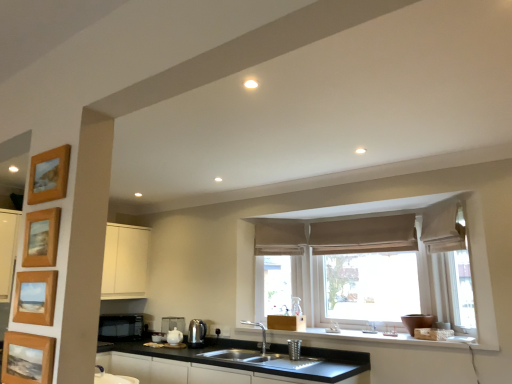
The width and height of the screenshot is (512, 384). What do you see at coordinates (279, 238) in the screenshot?
I see `brown fabric curtain at center, which is counted as the first curtain, starting from the left` at bounding box center [279, 238].

Where is `brown fabric curtain at center, the 3th curtain viewed from the right`? Image resolution: width=512 pixels, height=384 pixels. brown fabric curtain at center, the 3th curtain viewed from the right is located at coordinates (279, 238).

You are a GUI agent. You are given a task and a screenshot of the screen. Output one action in this format:
    pyautogui.click(x=<x>, y=<y>)
    Task: Click on the metallic silver cup at sink, the fourth appliance viewed from the back
    The image size is (512, 384).
    Given the screenshot: What is the action you would take?
    pyautogui.click(x=294, y=349)

What do you see at coordinates (365, 337) in the screenshot? I see `white matte window sill at center` at bounding box center [365, 337].

Locate an element on the screen. wooden photo frame at left, which appears as the fourth picture frame when viewed from the top is located at coordinates (27, 358).

Locate an element on the screen. beige fabric curtain at center, the second curtain positioned from the right is located at coordinates (364, 235).

Locate an element on the screen. brown fabric curtain at center, which is counted as the first curtain, starting from the left is located at coordinates point(279,238).

Is wooden picture frame at upper left, marked as the 2th picture frame in a top-to-bottom arrangement, facing towards beige fabric curtain at upper right, the first curtain viewed from the right?

No, wooden picture frame at upper left, marked as the 2th picture frame in a top-to-bottom arrangement, is not aimed at beige fabric curtain at upper right, the first curtain viewed from the right.

From the image's perspective, would you say wooden picture frame at upper left, marked as the 2th picture frame in a top-to-bottom arrangement, is positioned over beige fabric curtain at upper right, marked as the 3th curtain in a left-to-right arrangement?

Correct, wooden picture frame at upper left, marked as the 2th picture frame in a top-to-bottom arrangement, appears higher than beige fabric curtain at upper right, marked as the 3th curtain in a left-to-right arrangement, in the image.

Between wooden picture frame at upper left, marked as the 2th picture frame in a top-to-bottom arrangement, and beige fabric curtain at upper right, marked as the 3th curtain in a left-to-right arrangement, which one has more height?

Standing taller between the two is beige fabric curtain at upper right, marked as the 3th curtain in a left-to-right arrangement.

Which object is positioned more to the left, wooden picture frame at upper left, the third picture frame from the bottom, or beige fabric curtain at upper right, the first curtain viewed from the right?

wooden picture frame at upper left, the third picture frame from the bottom.

Is wooden picture frame at upper left, the third picture frame from the bottom, positioned in front of beige fabric window at center?

Yes, the depth of wooden picture frame at upper left, the third picture frame from the bottom, is less than that of beige fabric window at center.

From a real-world perspective, is wooden picture frame at upper left, the third picture frame from the bottom, positioned over beige fabric window at center based on gravity?

Yes, from a real-world perspective, wooden picture frame at upper left, the third picture frame from the bottom, is above beige fabric window at center.

Which point is more forward, (33, 255) or (324, 299)?

Point (33, 255)

Looking at this image, considering the relative sizes of wooden picture frame at upper left, which appears as the 1th picture frame when viewed from the top, and black matte microwave at lower left, marked as the first appliance in a left-to-right arrangement, in the image provided, is wooden picture frame at upper left, which appears as the 1th picture frame when viewed from the top, shorter than black matte microwave at lower left, marked as the first appliance in a left-to-right arrangement,?

Indeed, wooden picture frame at upper left, which appears as the 1th picture frame when viewed from the top, has a lesser height compared to black matte microwave at lower left, marked as the first appliance in a left-to-right arrangement.

Who is smaller, wooden picture frame at upper left, which appears as the 1th picture frame when viewed from the top, or black matte microwave at lower left, the 1th appliance positioned from the back?

wooden picture frame at upper left, which appears as the 1th picture frame when viewed from the top.

Can you confirm if wooden picture frame at upper left, which appears as the 1th picture frame when viewed from the top, is positioned to the right of black matte microwave at lower left, which is counted as the fourth appliance, starting from the right?

Correct, you'll find wooden picture frame at upper left, which appears as the 1th picture frame when viewed from the top, to the right of black matte microwave at lower left, which is counted as the fourth appliance, starting from the right.

From the image's perspective, is wooden picture frame at upper left, which is the 4th picture frame from bottom to top, on black matte microwave at lower left, marked as the first appliance in a left-to-right arrangement?

Yes, from the image's perspective, wooden picture frame at upper left, which is the 4th picture frame from bottom to top, is on top of black matte microwave at lower left, marked as the first appliance in a left-to-right arrangement.

Which object is wider, beige fabric curtain at right or beige fabric curtain at center, the second curtain positioned from the right?

beige fabric curtain at right.

From the image's perspective, which is below, beige fabric curtain at right or beige fabric curtain at center, the second curtain positioned from the right?

beige fabric curtain at right.

Looking at this image, can you confirm if beige fabric curtain at right is smaller than beige fabric curtain at center, which is the 2th curtain in left-to-right order?

No.

From a real-world perspective, which object rests below the other?

beige fabric curtain at right is physically lower.

Which is more to the left, brown fabric curtain at center, the 3th curtain viewed from the right, or white matte window sill at center?

brown fabric curtain at center, the 3th curtain viewed from the right.

This screenshot has height=384, width=512. Identify the location of window sill lying on the right of brown fabric curtain at center, which is counted as the first curtain, starting from the left. (365, 337).

From a real-world perspective, is brown fabric curtain at center, the 3th curtain viewed from the right, above or below white matte window sill at center?

brown fabric curtain at center, the 3th curtain viewed from the right, is situated higher than white matte window sill at center in the real world.

Considering the points (257, 221) and (329, 335), which point is behind, point (257, 221) or point (329, 335)?

Positioned behind is point (257, 221).

Between point (188, 344) and point (359, 330), which one is positioned in front?

The point (359, 330) is closer.

Between satin silver kettle at lower center, the 2th appliance viewed from the front, and white matte window sill at center, which one appears on the left side from the viewer's perspective?

satin silver kettle at lower center, the 2th appliance viewed from the front.

From the image's perspective, does satin silver kettle at lower center, the 2th appliance viewed from the front, appear higher than white matte window sill at center?

Actually, satin silver kettle at lower center, the 2th appliance viewed from the front, appears below white matte window sill at center in the image.

I want to click on the 2nd picture frame to the right when counting from the wooden framed picture at left, the 3th picture frame in the top-to-bottom sequence, so point(49,175).

Between wooden picture frame at upper left, which appears as the 1th picture frame when viewed from the top, and wooden framed picture at left, the 2th picture frame positioned from the bottom, which one appears on the right side from the viewer's perspective?

From the viewer's perspective, wooden picture frame at upper left, which appears as the 1th picture frame when viewed from the top, appears more on the right side.

Can you confirm if wooden picture frame at upper left, which is the 4th picture frame from bottom to top, is shorter than wooden framed picture at left, the 3th picture frame in the top-to-bottom sequence?

No.

From a real-world perspective, which curtain is the 1st one above the wooden picture frame at upper left, marked as the 2th picture frame in a top-to-bottom arrangement? Please provide its 2D coordinates.

[(443, 228)]

Find the location of a particular element. The width and height of the screenshot is (512, 384). the 4th picture frame to the left when counting from the beige fabric window at center is located at coordinates (41, 238).

Looking at the image, which one is located further to brown fabric curtain at center, which is counted as the first curtain, starting from the left, white matte window sill at center or beige fabric window at center?

white matte window sill at center.

When comparing their distances from beige fabric curtain at upper right, the first curtain viewed from the right, does white ceramic teapot at lower center, the 2th appliance positioned from the left, or beige fabric window at center seem further?

Based on the image, white ceramic teapot at lower center, the 2th appliance positioned from the left, appears to be further to beige fabric curtain at upper right, the first curtain viewed from the right.

From the image, which object appears to be farther from white matte window sill at center, satin silver kettle at lower center, which ranks as the 3th appliance in back-to-front order, or beige fabric curtain at center, the second curtain positioned from the right?

satin silver kettle at lower center, which ranks as the 3th appliance in back-to-front order.

From the image, which object appears to be farther from black matte cabinet at lower center, beige fabric curtain at center, which is the 2th curtain in left-to-right order, or beige fabric curtain at upper right, marked as the 3th curtain in a left-to-right arrangement?

beige fabric curtain at upper right, marked as the 3th curtain in a left-to-right arrangement, lies further to black matte cabinet at lower center than the other object.

Based on their spatial positions, is beige fabric curtain at center, the second curtain positioned from the right, or white ceramic teapot at lower center, the 2th appliance positioned from the left, closer to black matte microwave at lower left, the 1th appliance positioned from the back?

Among the two, white ceramic teapot at lower center, the 2th appliance positioned from the left, is located nearer to black matte microwave at lower left, the 1th appliance positioned from the back.

Considering their positions, is wooden photo frame at left, which appears as the fourth picture frame when viewed from the top, positioned further to white ceramic teapot at lower center, the 2th appliance positioned from the left, than black matte cabinet at lower center?

wooden photo frame at left, which appears as the fourth picture frame when viewed from the top, is positioned further to the anchor white ceramic teapot at lower center, the 2th appliance positioned from the left.

From the image, which object appears to be farther from black matte microwave at lower left, arranged as the 4th appliance when viewed from the front, brown fabric curtain at center, which is counted as the first curtain, starting from the left, or white matte window sill at center?

white matte window sill at center is further to black matte microwave at lower left, arranged as the 4th appliance when viewed from the front.

From the image, which object appears to be nearer to white matte window sill at center, beige fabric window at center or wooden picture frame at upper left, the third picture frame from the bottom?

Based on the image, beige fabric window at center appears to be nearer to white matte window sill at center.

Locate an element on the screen. window sill between black matte microwave at lower left, the 1th appliance positioned from the back, and beige fabric window at center, in the horizontal direction is located at coordinates (365, 337).

What are the coordinates of `curtain between white ceramic teapot at lower center, positioned as the 2th appliance in back-to-front order, and metallic silver cup at sink, which appears as the first appliance when viewed from the front, from left to right` in the screenshot? It's located at (279, 238).

Find the location of a particular element. picture frame positioned between wooden picture frame at upper left, the third picture frame from the bottom, and beige fabric window at center from near to far is located at coordinates (49, 175).

This screenshot has height=384, width=512. Find the location of `window sill situated between wooden photo frame at left, which appears as the fourth picture frame when viewed from the top, and beige fabric curtain at right from left to right`. window sill situated between wooden photo frame at left, which appears as the fourth picture frame when viewed from the top, and beige fabric curtain at right from left to right is located at coordinates (365, 337).